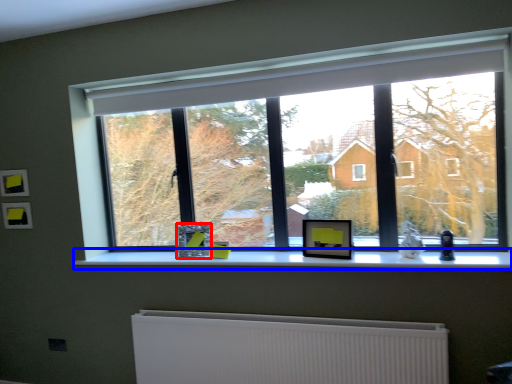
Question: Among these objects, which one is farthest to the camera, picture frame (highlighted by a red box) or window sill (highlighted by a blue box)?

Choices:
 (A) picture frame
 (B) window sill

Answer: (A)